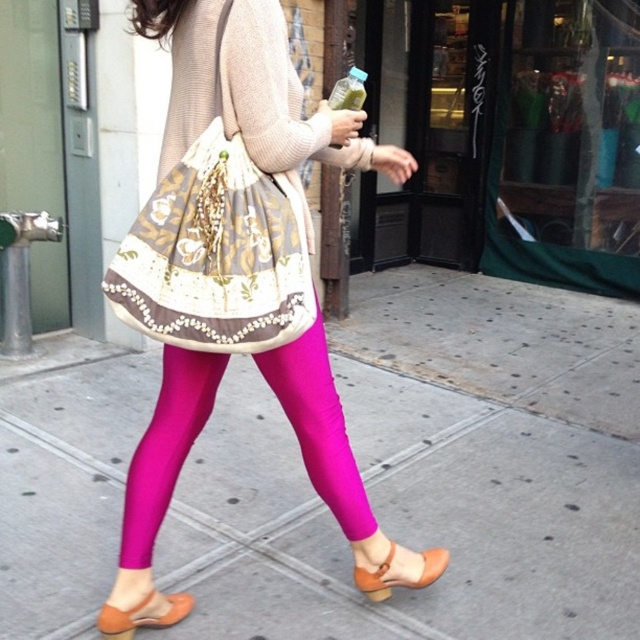
You are a fashion designer observing the person walking on the sidewalk. You need to decide which item is longer between the pink fabric leggings at center and the embroidered fabric bag at center. Based on the scene, which one is taller?

The pink fabric leggings at center is much taller as embroidered fabric bag at center.

You are a fashion designer observing a pedestrian on the sidewalk. You notice the matte pink leggings at center and the embroidered fabric bag at center. Which item is located to the right of the other?

The matte pink leggings at center is positioned on the right side of embroidered fabric bag at center.